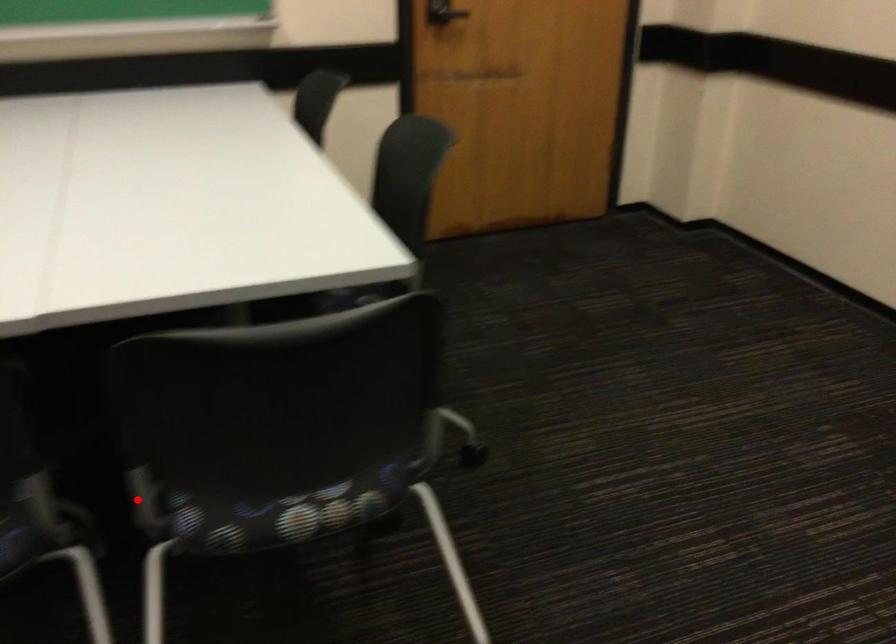
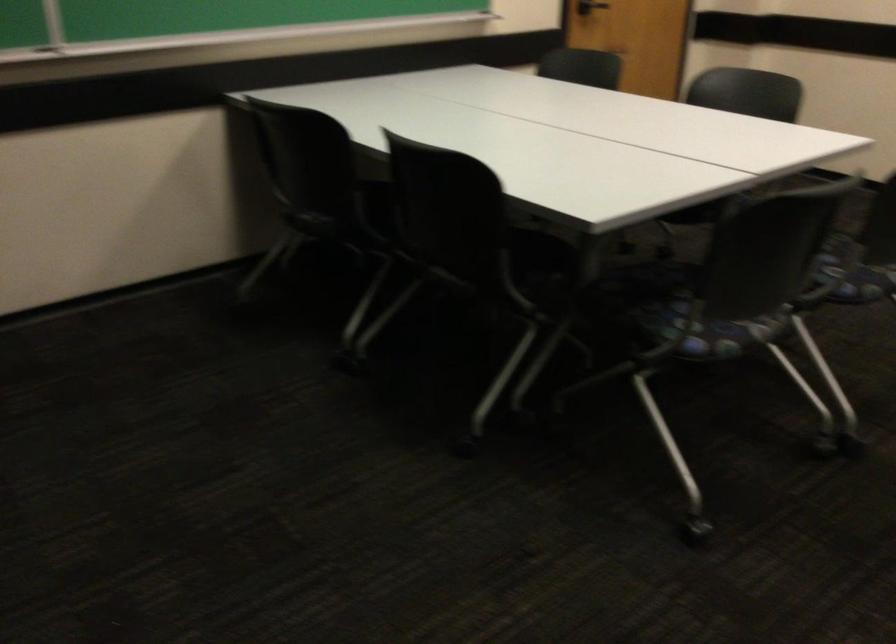
Question: I am providing you with two images of the same scene from different viewpoints. Image1 has a red point marked. In image2, the corresponding 3D location appears at what relative position? Reply with the corresponding letter.

Choices:
 (A) Closer
 (B) Farther

Answer: (B)